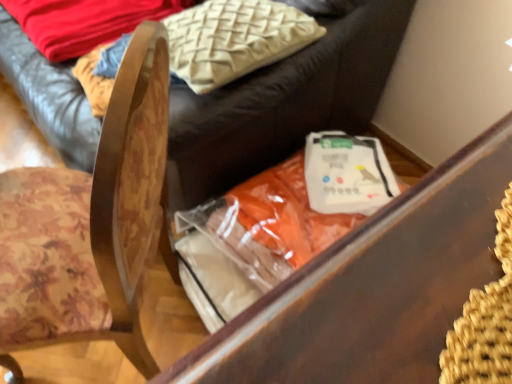
Describe the element at coordinates (130, 191) in the screenshot. I see `wooden chair at center` at that location.

What do you see at coordinates (347, 173) in the screenshot? I see `white matte plastic bag at center` at bounding box center [347, 173].

What are the coordinates of `beige textured pillow at upper center` in the screenshot? It's located at (234, 39).

Which object is thinner, wooden chair at center or beige textured pillow at upper center?

beige textured pillow at upper center.

What's the angular difference between wooden chair at center and beige textured pillow at upper center's facing directions?

They differ by 36.8 degrees in their facing directions.

Based on the photo, between wooden chair at center and beige textured pillow at upper center, which one has more height?

wooden chair at center.

From the image's perspective, is wooden chair at center beneath beige textured pillow at upper center?

Yes.

Is wooden chair at lower left, the first furniture viewed from the top, facing away from white matte plastic bag at center?

No, wooden chair at lower left, the first furniture viewed from the top, is not facing away from white matte plastic bag at center.

Between wooden chair at lower left, the first furniture viewed from the top, and white matte plastic bag at center, which one has larger width?

wooden chair at lower left, the first furniture viewed from the top.

Is point (210, 144) more distant than point (331, 175)?

No, (210, 144) is closer to viewer.

Between wooden chair at lower left, the first furniture viewed from the top, and white matte plastic bag at center, which one has smaller size?

With smaller size is white matte plastic bag at center.

Would you say wooden chair at lower left, the first furniture viewed from the top, contains orange fabric bag at center, which is counted as the second furniture, starting from the top?

That's incorrect, orange fabric bag at center, which is counted as the second furniture, starting from the top, is not inside wooden chair at lower left, the first furniture viewed from the top.

Locate an element on the screen. This screenshot has width=512, height=384. furniture that appears on the right of wooden chair at lower left, the second furniture ordered from the bottom is located at coordinates (374, 287).

Which is in front, point (229, 135) or point (400, 335)?

The point (400, 335) is closer.

Considering the relative positions of wooden chair at center and wooden chair at lower left, the first furniture viewed from the top, in the image provided, is wooden chair at center to the left or to the right of wooden chair at lower left, the first furniture viewed from the top,?

Clearly, wooden chair at center is on the right of wooden chair at lower left, the first furniture viewed from the top, in the image.

Is wooden chair at center completely or partially outside of wooden chair at lower left, the first furniture viewed from the top?

That's correct, wooden chair at center is outside of wooden chair at lower left, the first furniture viewed from the top.

Considering the sizes of wooden chair at center and wooden chair at lower left, the second furniture ordered from the bottom, in the image, is wooden chair at center bigger or smaller than wooden chair at lower left, the second furniture ordered from the bottom,?

Considering their sizes, wooden chair at center takes up less space than wooden chair at lower left, the second furniture ordered from the bottom.

From a real-world perspective, between white matte plastic bag at center and wooden chair at center, who is vertically lower?

white matte plastic bag at center.

Is white matte plastic bag at center to the left of wooden chair at center from the viewer's perspective?

No, white matte plastic bag at center is not to the left of wooden chair at center.

Are white matte plastic bag at center and wooden chair at center beside each other?

white matte plastic bag at center and wooden chair at center are clearly separated.

This screenshot has width=512, height=384. Identify the location of food on the right of orange fabric bag at center, which is counted as the second furniture, starting from the top. (347, 173).

Which of these two, white matte plastic bag at center or orange fabric bag at center, which is counted as the second furniture, starting from the top, is thinner?

white matte plastic bag at center is thinner.

Does white matte plastic bag at center have a greater height compared to orange fabric bag at center, which is counted as the second furniture, starting from the top?

No, white matte plastic bag at center is not taller than orange fabric bag at center, which is counted as the second furniture, starting from the top.

Does wooden chair at lower left, the second furniture ordered from the bottom, have a larger size compared to wooden chair at center?

Yes.

Between wooden chair at lower left, the first furniture viewed from the top, and wooden chair at center, which one is positioned in front?

wooden chair at center.

How different are the orientations of wooden chair at lower left, the second furniture ordered from the bottom, and wooden chair at center in degrees?

36.8 degrees separate the facing orientations of wooden chair at lower left, the second furniture ordered from the bottom, and wooden chair at center.

Is wooden chair at lower left, the first furniture viewed from the top, turned away from wooden chair at center?

No, wooden chair at lower left, the first furniture viewed from the top, is not facing the opposite direction of wooden chair at center.

Identify the location of pillow that appears behind the wooden chair at center. (234, 39).

Where is `furniture that appears above the white matte plastic bag at center (from the image's perspective)`? The height and width of the screenshot is (384, 512). furniture that appears above the white matte plastic bag at center (from the image's perspective) is located at coordinates (283, 103).

When comparing their distances from wooden chair at center, does wooden chair at lower left, the first furniture viewed from the top, or beige textured pillow at upper center seem closer?

beige textured pillow at upper center is positioned closer to the anchor wooden chair at center.

When comparing their distances from wooden chair at lower left, the second furniture ordered from the bottom, does white matte plastic bag at center or beige textured pillow at upper center seem closer?

beige textured pillow at upper center.

Which object lies further to the anchor point white matte plastic bag at center, wooden chair at center or wooden chair at lower left, the first furniture viewed from the top?

Based on the image, wooden chair at center appears to be further to white matte plastic bag at center.

From the picture: From the image, which object appears to be nearer to orange fabric bag at center, which is counted as the second furniture, starting from the top, white matte plastic bag at center or wooden chair at center?

wooden chair at center.

When comparing their distances from wooden chair at center, does orange fabric bag at center, which is counted as the second furniture, starting from the top, or beige textured pillow at upper center seem further?

The object further to wooden chair at center is orange fabric bag at center, which is counted as the second furniture, starting from the top.

Considering their positions, is white matte plastic bag at center positioned closer to beige textured pillow at upper center than orange fabric bag at center, arranged as the 1th furniture when ordered from the bottom?

white matte plastic bag at center is positioned closer to the anchor beige textured pillow at upper center.

When comparing their distances from beige textured pillow at upper center, does white matte plastic bag at center or wooden chair at lower left, the first furniture viewed from the top, seem closer?

wooden chair at lower left, the first furniture viewed from the top, lies closer to beige textured pillow at upper center than the other object.

When comparing their distances from wooden chair at lower left, the first furniture viewed from the top, does beige textured pillow at upper center or orange fabric bag at center, which is counted as the second furniture, starting from the top, seem further?

orange fabric bag at center, which is counted as the second furniture, starting from the top, is positioned further to the anchor wooden chair at lower left, the first furniture viewed from the top.

Where is `chair that lies between beige textured pillow at upper center and orange fabric bag at center, which is counted as the second furniture, starting from the top, from top to bottom`? Image resolution: width=512 pixels, height=384 pixels. chair that lies between beige textured pillow at upper center and orange fabric bag at center, which is counted as the second furniture, starting from the top, from top to bottom is located at coordinates (130, 191).

Find the location of a particular element. The image size is (512, 384). food between wooden chair at lower left, the second furniture ordered from the bottom, and orange fabric bag at center, which is counted as the second furniture, starting from the top, in the vertical direction is located at coordinates (347, 173).

You are a GUI agent. You are given a task and a screenshot of the screen. Output one action in this format:
    pyautogui.click(x=<x>, y=<y>)
    Task: Click on the pillow between wooden chair at lower left, the second furniture ordered from the bottom, and white matte plastic bag at center in the up-down direction
    The height and width of the screenshot is (384, 512).
    Given the screenshot: What is the action you would take?
    pyautogui.click(x=234, y=39)

Image resolution: width=512 pixels, height=384 pixels. What are the coordinates of `food between wooden chair at lower left, the second furniture ordered from the bottom, and wooden chair at center vertically` in the screenshot? It's located at (347, 173).